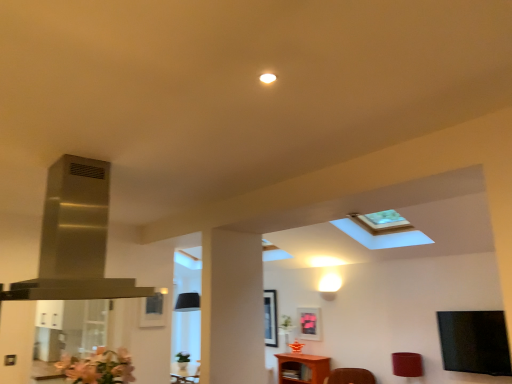
Question: In the image, is stainless steel exhaust hood at upper left positioned in front of or behind matte pink picture frame at center, the 2th picture frame from the front?

Choices:
 (A) front
 (B) behind

Answer: (A)

Question: Is stainless steel exhaust hood at upper left to the left or to the right of matte pink picture frame at center, the 2th picture frame from the front, in the image?

Choices:
 (A) right
 (B) left

Answer: (B)

Question: Estimate the real-world distances between objects in this image. Which object is farther from the brown wooden table at lower center?

Choices:
 (A) matte black picture frame at center, the first picture frame positioned from the back
 (B) matte red lampshade at lower right
 (C) stainless steel exhaust hood at upper left
 (D) matte black picture frame at center, which is the third picture frame from right to left
 (E) matte pink picture frame at center, the first picture frame viewed from the right

Answer: (C)

Question: Which object is positioned closest to the matte black picture frame at center, which ranks as the second picture frame in left-to-right order?

Choices:
 (A) matte pink picture frame at center, the first picture frame viewed from the right
 (B) pink matte flower at lower left
 (C) brown wooden table at lower center
 (D) transparent glass door at left
 (E) matte black picture frame at center, which is the third picture frame from right to left

Answer: (A)